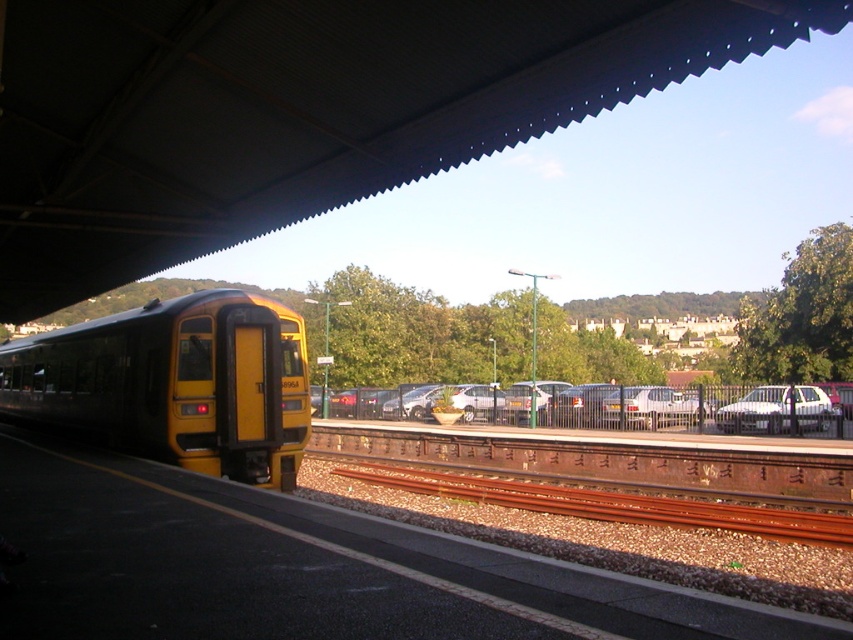
This screenshot has width=853, height=640. I want to click on silver metallic car at center, so click(x=704, y=408).

Is point (791, 429) positioned behind point (682, 422)?

No.

The height and width of the screenshot is (640, 853). What do you see at coordinates (704, 408) in the screenshot?
I see `silver metallic car at center` at bounding box center [704, 408].

Image resolution: width=853 pixels, height=640 pixels. Find the location of `silver metallic car at center`. silver metallic car at center is located at coordinates (704, 408).

Can you confirm if yellow matte train at left is shorter than white matte car at center?

No.

Which is behind, point (154, 376) or point (666, 403)?

The point (666, 403) is more distant.

Image resolution: width=853 pixels, height=640 pixels. Identify the location of yellow matte train at left. (175, 384).

Which is more to the left, silver metallic car at center or white matte car at right?

silver metallic car at center is more to the left.

Who is higher up, silver metallic car at center or white matte car at right?

white matte car at right is above.

This screenshot has width=853, height=640. What are the coordinates of `silver metallic car at center` in the screenshot? It's located at (704, 408).

This screenshot has height=640, width=853. Identify the location of silver metallic car at center. point(704,408).